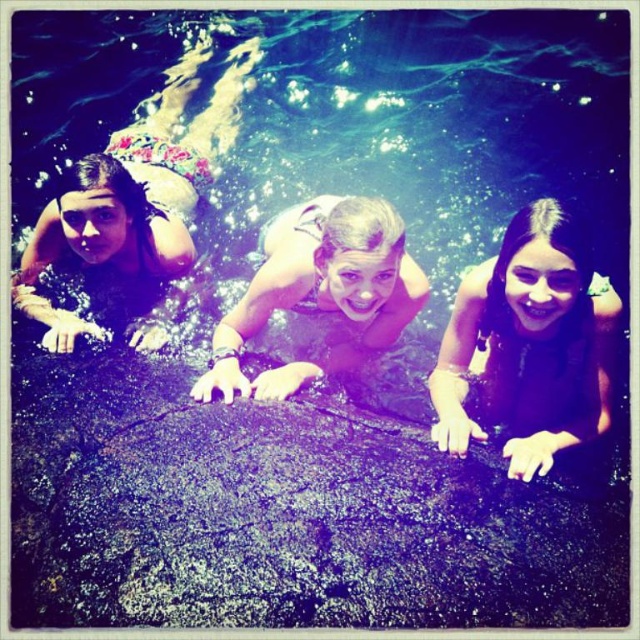
In the scene where three people are partially submerged in water at a beach or poolside, you need to determine which of the two central figures has a wider width between the black matte hair at center and the smooth skin girl at center. Based on their positions and the description provided, which one is wider?

The smooth skin girl at center is wider than the black matte hair at center as stated in the description.

You are a photographer trying to capture a closeup shot of the two points in the image. Which point, point [541,365] or point [51,220], would appear larger in your photo?

Point [541,365] is closer to the camera than point [51,220], so it would appear larger in the photo.

You are a photographer trying to capture a candid shot of the black matte hair at center and the floral swimsuit at left. Based on their positions, which one would appear larger in your photo?

The black matte hair at center appears larger in the photo because it is closer to the viewer than the floral swimsuit at left.